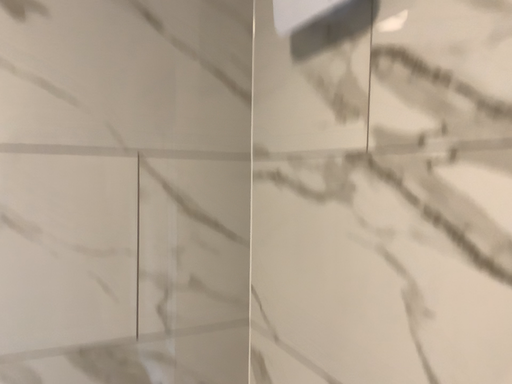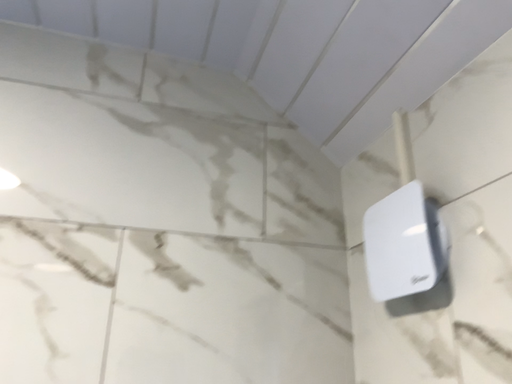
Question: How did the camera likely rotate when shooting the video?

Choices:
 (A) rotated downward
 (B) rotated upward

Answer: (B)